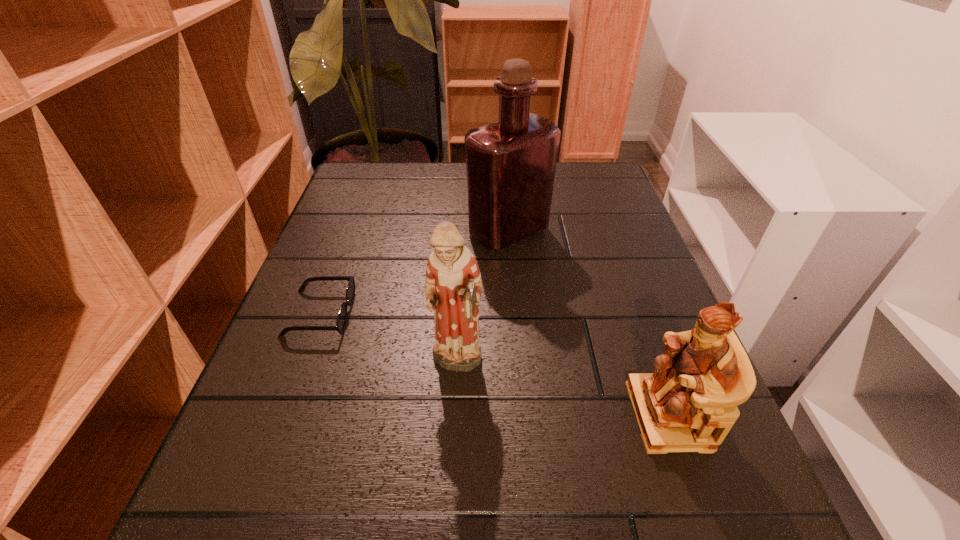
The height and width of the screenshot is (540, 960). I want to click on the farthest object, so click(510, 164).

Where is `liquor`? The height and width of the screenshot is (540, 960). liquor is located at coordinates (510, 164).

In order to click on the second tallest object in this screenshot , I will do `click(453, 287)`.

The height and width of the screenshot is (540, 960). What are the coordinates of `the taller figurine` in the screenshot? It's located at (453, 287).

The height and width of the screenshot is (540, 960). I want to click on the right figurine, so click(689, 403).

The image size is (960, 540). I want to click on the third tallest object, so click(x=689, y=403).

At what (x,y) coordinates should I click in order to perform the action: click on sunglasses. Please return your answer as a coordinate pair (x, y). Looking at the image, I should click on (341, 320).

Locate an element on the screen. The height and width of the screenshot is (540, 960). the leftmost object is located at coordinates (341, 320).

Image resolution: width=960 pixels, height=540 pixels. In order to click on vacant area situated on the right of the liquor in this screenshot , I will do `click(603, 232)`.

At what (x,y) coordinates should I click in order to perform the action: click on vacant region located on the front-facing side of the second tallest object. Please return your answer as a coordinate pair (x, y). Image resolution: width=960 pixels, height=540 pixels. Looking at the image, I should click on (448, 534).